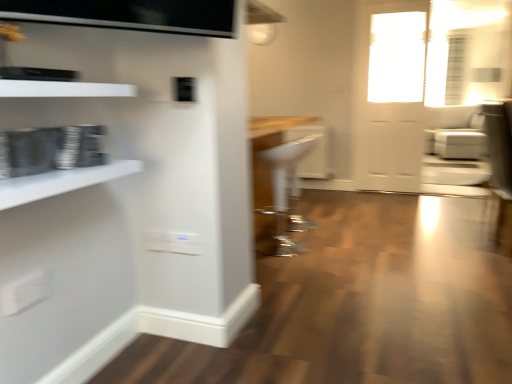
Question: From the image's perspective, relative to white glossy door at upper right, is white glossy shelf at left, which is the 1th shelf in bottom-to-top order, above or below?

Choices:
 (A) above
 (B) below

Answer: (B)

Question: Relative to white glossy door at upper right, is white glossy shelf at left, placed as the 2th shelf when sorted from top to bottom, in front or behind?

Choices:
 (A) front
 (B) behind

Answer: (A)

Question: Which of these objects is positioned closest to the white leather armchair at right, positioned as the 2th armchair in left-to-right order?

Choices:
 (A) white plastic stool at center, marked as the second armchair in a back-to-front arrangement
 (B) white glossy shelf at left, placed as the 2th shelf when sorted from top to bottom
 (C) white glossy shelf at upper left, arranged as the 2th shelf when ordered from the bottom
 (D) white glossy door at upper right
 (E) clear glass door at upper right

Answer: (D)

Question: Estimate the real-world distances between objects in this image. Which object is closer to the clear glass door at upper right?

Choices:
 (A) white plastic stool at center, marked as the second armchair in a back-to-front arrangement
 (B) white glossy door at upper right
 (C) white glossy shelf at left, placed as the 2th shelf when sorted from top to bottom
 (D) white glossy shelf at upper left, arranged as the 2th shelf when ordered from the bottom
 (E) white leather armchair at right, positioned as the 2th armchair in left-to-right order

Answer: (B)